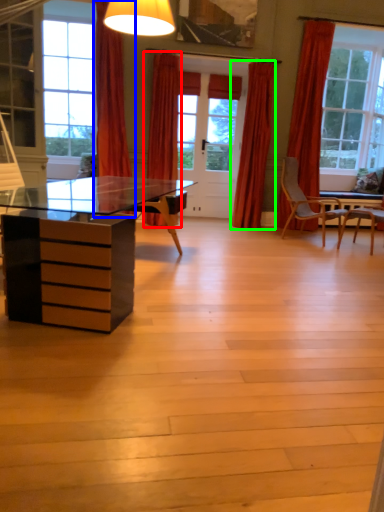
Question: Based on their relative distances, which object is farther from curtain (highlighted by a red box)? Choose from curtain (highlighted by a blue box) and curtain (highlighted by a green box).

Choices:
 (A) curtain
 (B) curtain

Answer: (B)